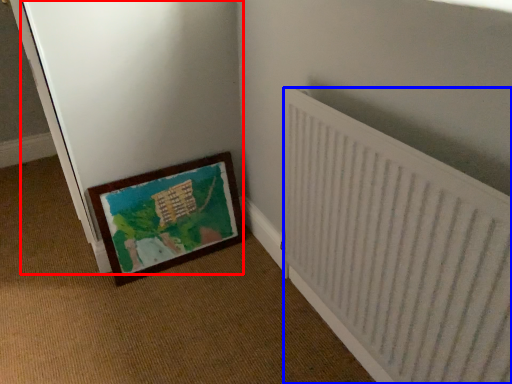
Question: Among these objects, which one is nearest to the camera, screen door (highlighted by a red box) or radiator (highlighted by a blue box)?

Choices:
 (A) screen door
 (B) radiator

Answer: (B)